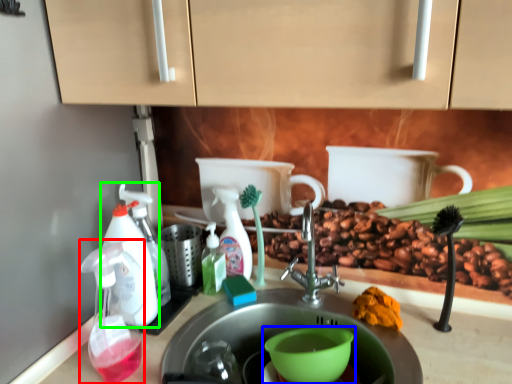
Question: Considering the real-world distances, which object is farthest from soap dispenser (highlighted by a red box)? coffee cup (highlighted by a blue box) or soap dispenser (highlighted by a green box)?

Choices:
 (A) coffee cup
 (B) soap dispenser

Answer: (A)